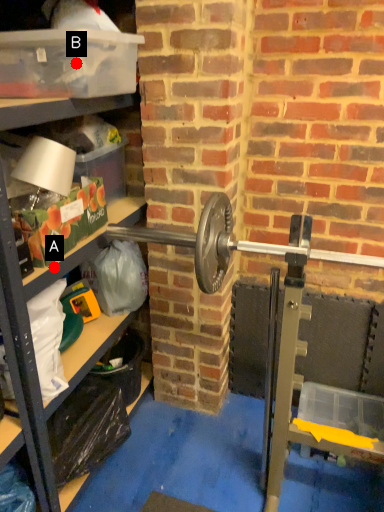
Question: Two points are circled on the image, labeled by A and B beside each circle. Among these points, which one is nearest to the camera?

Choices:
 (A) A is closer
 (B) B is closer

Answer: (B)